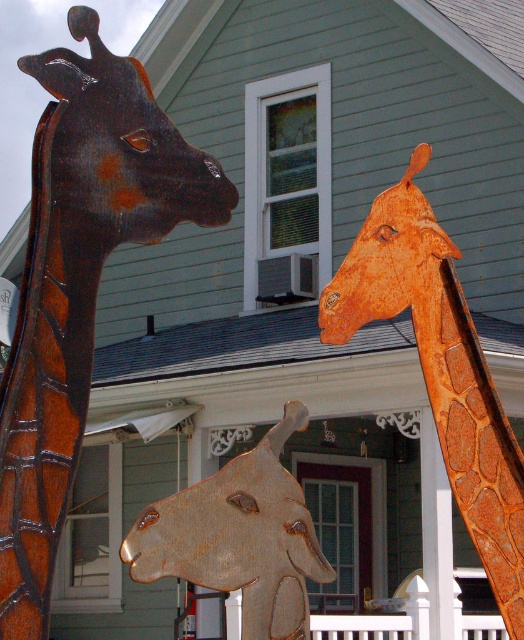
Looking at this image, between rusty metal giraffe at upper left and rusty wood giraffe head at center, which one is positioned lower?

rusty metal giraffe at upper left is lower down.

Locate an element on the screen. Image resolution: width=524 pixels, height=640 pixels. rusty metal giraffe at upper left is located at coordinates (79, 284).

At what (x,y) coordinates should I click in order to perform the action: click on rusty metal giraffe at upper left. Please return your answer as a coordinate pair (x, y). The image size is (524, 640). Looking at the image, I should click on (79, 284).

Is rusty metal giraffe at upper left smaller than rusty metal giraffe at upper right?

Correct, rusty metal giraffe at upper left occupies less space than rusty metal giraffe at upper right.

Who is taller, rusty metal giraffe at upper left or rusty metal giraffe at upper right?

Standing taller between the two is rusty metal giraffe at upper right.

Locate an element on the screen. Image resolution: width=524 pixels, height=640 pixels. rusty metal giraffe at upper left is located at coordinates (79, 284).

Between point (424, 316) and point (291, 582), which one is positioned in front?

Point (291, 582)

Between rusty metal giraffe at upper right and rusty wood giraffe head at center, which one is positioned lower?

Positioned lower is rusty wood giraffe head at center.

Find the location of a particular element. This screenshot has height=640, width=524. rusty metal giraffe at upper right is located at coordinates (440, 369).

I want to click on rusty metal giraffe at upper right, so click(x=440, y=369).